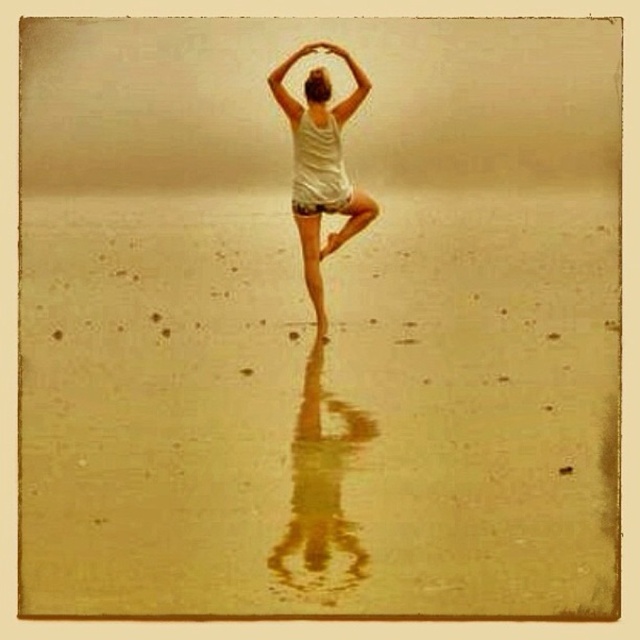
You are a photographer positioned behind the yoga practitioner. You want to capture a photo where the smooth golden sand at center is in focus while keeping the smooth blonde hair at upper center slightly blurred. Is this possible based on their positions?

Yes, since the smooth golden sand at center is closer to the viewer than the smooth blonde hair at upper center, adjusting the camera focus to the closer object will blur the background, making the sand sharp and the hair slightly out of focus.

You are a photographer trying to capture the reflection of the white cotton tank top at center in the smooth golden sand at center. Based on the scene, can you confirm if the reflection is visible?

Yes, the reflection of the white cotton tank top at center is visible on the smooth golden sand at center because the sand is described as a reflective surface.

You are a photographer trying to capture the reflection of the yoga practitioner in the smooth golden sand at center. Since the smooth blonde hair at upper center might block the reflection, can you determine if the sand area is wide enough to fully capture the reflection without obstruction?

The smooth golden sand at center has a larger width than the smooth blonde hair at upper center, so the sand area is wide enough to fully capture the reflection without obstruction from the hair.